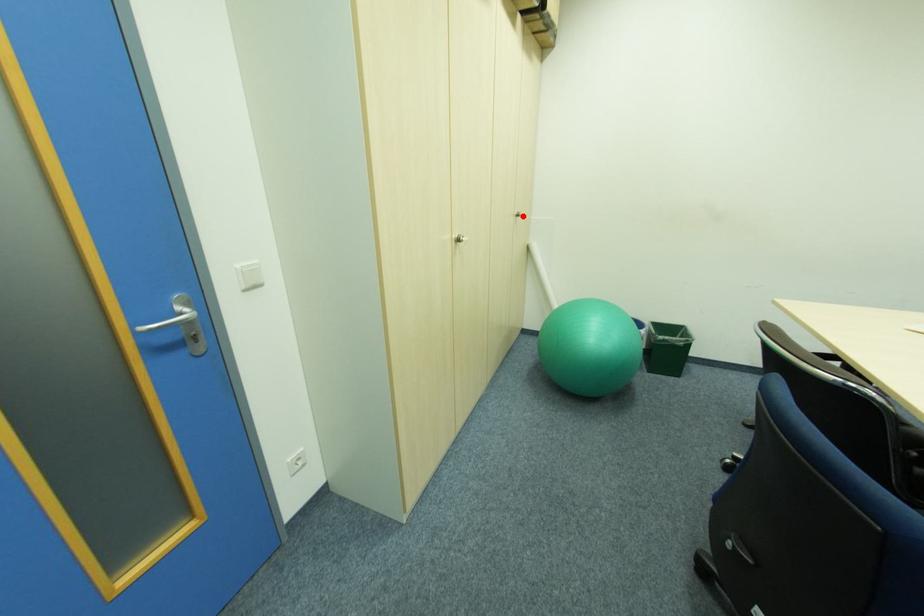
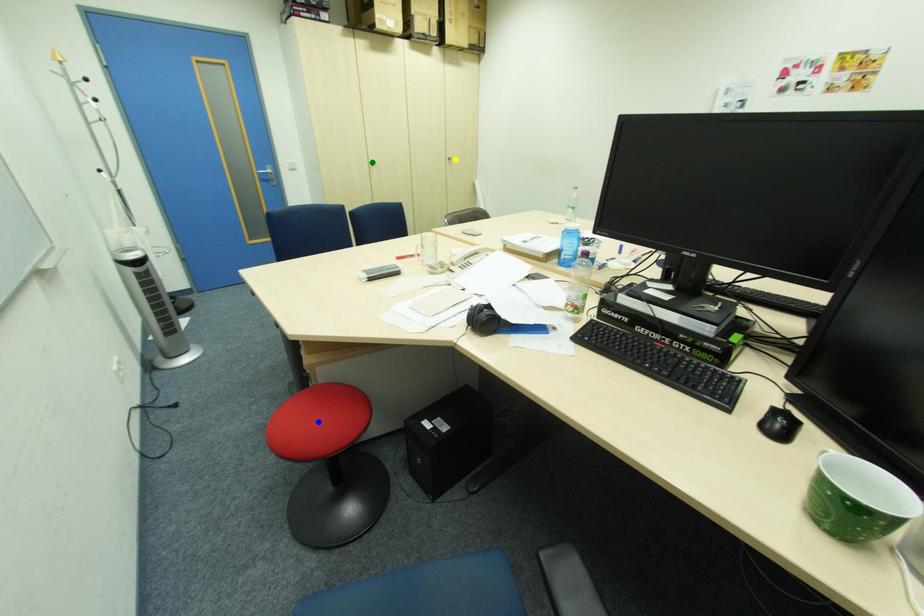
Question: I am providing you with two images of the same scene from different viewpoints. A red point is marked on the first image. You are given multiple points on the second image. Which point in image 2 is actually the same real-world point as the red point in image 1?

Choices:
 (A) blue point
 (B) yellow point
 (C) green point

Answer: (B)